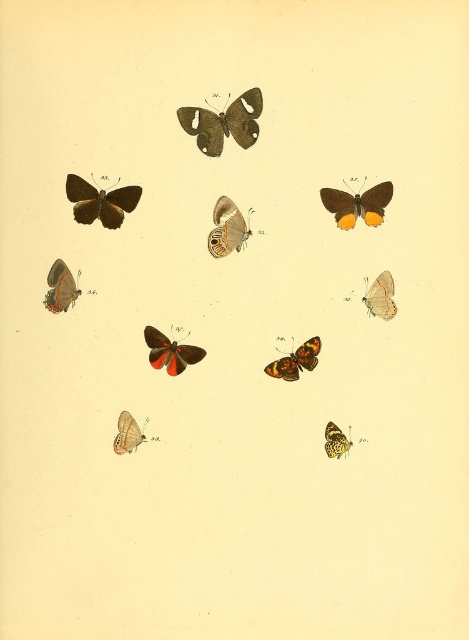
Which of these two, matte brown butterfly at upper left or matte brown butterfly at left, stands taller?

With more height is matte brown butterfly at upper left.

Is matte brown butterfly at upper left positioned before matte brown butterfly at left?

Yes, matte brown butterfly at upper left is closer to the viewer.

Does point (81, 198) come in front of point (51, 291)?

Yes, it is in front of point (51, 291).

Identify the location of matte brown butterfly at upper left. This screenshot has height=640, width=469. (99, 202).

The height and width of the screenshot is (640, 469). What do you see at coordinates (356, 204) in the screenshot?
I see `orange-yellow spotted butterfly at upper right` at bounding box center [356, 204].

Between orange-yellow spotted butterfly at upper right and orange-brown spotted butterfly at center, which one is positioned higher?

orange-yellow spotted butterfly at upper right

At what (x,y) coordinates should I click in order to perform the action: click on orange-yellow spotted butterfly at upper right. Please return your answer as a coordinate pair (x, y). The height and width of the screenshot is (640, 469). Looking at the image, I should click on (356, 204).

Does orange-yellow spotted butterfly at upper right have a greater height compared to shiny silver butterfly at bottom left?

Correct, orange-yellow spotted butterfly at upper right is much taller as shiny silver butterfly at bottom left.

Who is higher up, orange-yellow spotted butterfly at upper right or shiny silver butterfly at bottom left?

orange-yellow spotted butterfly at upper right is higher up.

Between point (391, 198) and point (126, 448), which one is positioned in front?

Point (391, 198) is more forward.

This screenshot has height=640, width=469. Find the location of `orange-yellow spotted butterfly at upper right`. orange-yellow spotted butterfly at upper right is located at coordinates (356, 204).